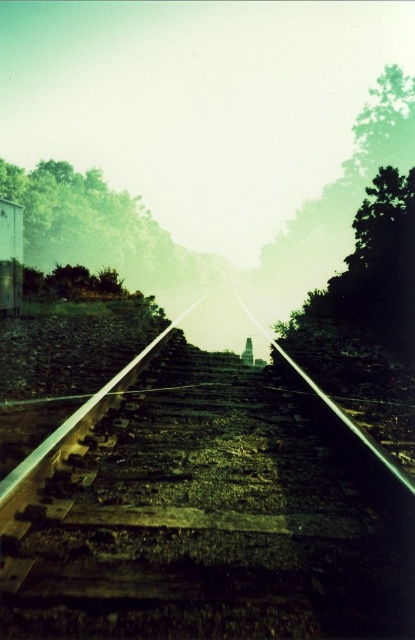
Does smooth metal train track at center lie in front of green leafy tree at upper left?

That is True.

Based on the photo, is smooth metal train track at center below green leafy tree at upper left?

Indeed, smooth metal train track at center is positioned under green leafy tree at upper left.

Where is `smooth metal train track at center`? The height and width of the screenshot is (640, 415). smooth metal train track at center is located at coordinates (202, 513).

Who is more distant from viewer, [349,301] or [400,112]?

Point [400,112]

Is green leafy tree at right below green leafy tree at upper right?

Yes, green leafy tree at right is below green leafy tree at upper right.

Is point (365, 317) closer to viewer compared to point (305, 236)?

That is True.

Locate an element on the screen. The height and width of the screenshot is (640, 415). green leafy tree at right is located at coordinates (373, 268).

Does green leafy tree at upper left come in front of green leafy tree at upper right?

Yes.

Between point (90, 256) and point (349, 230), which one is positioned behind?

The point (349, 230) is more distant.

Where is `green leafy tree at upper left`? This screenshot has width=415, height=640. green leafy tree at upper left is located at coordinates (99, 228).